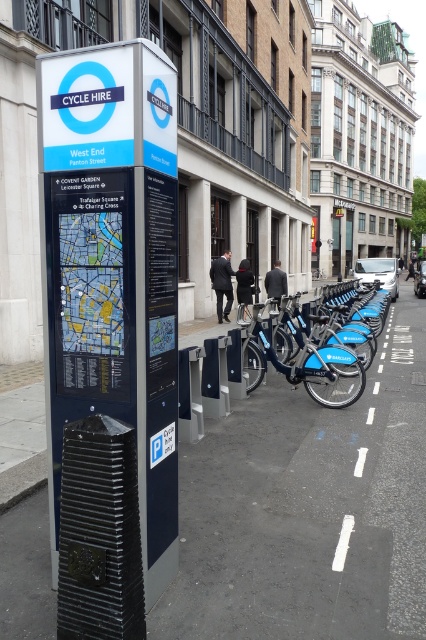
Question: Is black rubber pavement at lower center thinner than metallic blue sign at center?

Choices:
 (A) yes
 (B) no

Answer: (B)

Question: Among these objects, which one is nearest to the camera?

Choices:
 (A) blue metallic bicycle at center
 (B) black rubber pavement at lower center

Answer: (B)

Question: Is black rubber pavement at lower center thinner than blue metallic bicycle at center?

Choices:
 (A) yes
 (B) no

Answer: (B)

Question: Which point is farther from the camera taking this photo?

Choices:
 (A) (299, 374)
 (B) (244, 432)
 (C) (363, 330)

Answer: (C)

Question: Which object is positioned farthest from the metallic blue sign at center?

Choices:
 (A) black rubber pavement at lower center
 (B) blue matte bicycle at center

Answer: (B)

Question: Is blue matte bicycle at center positioned in front of blue metallic bicycle at center?

Choices:
 (A) yes
 (B) no

Answer: (A)